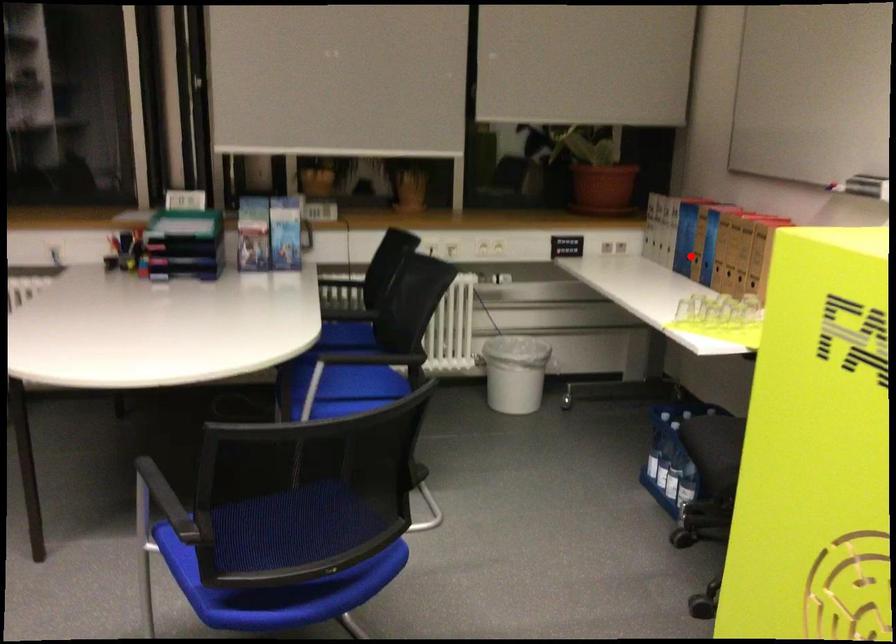
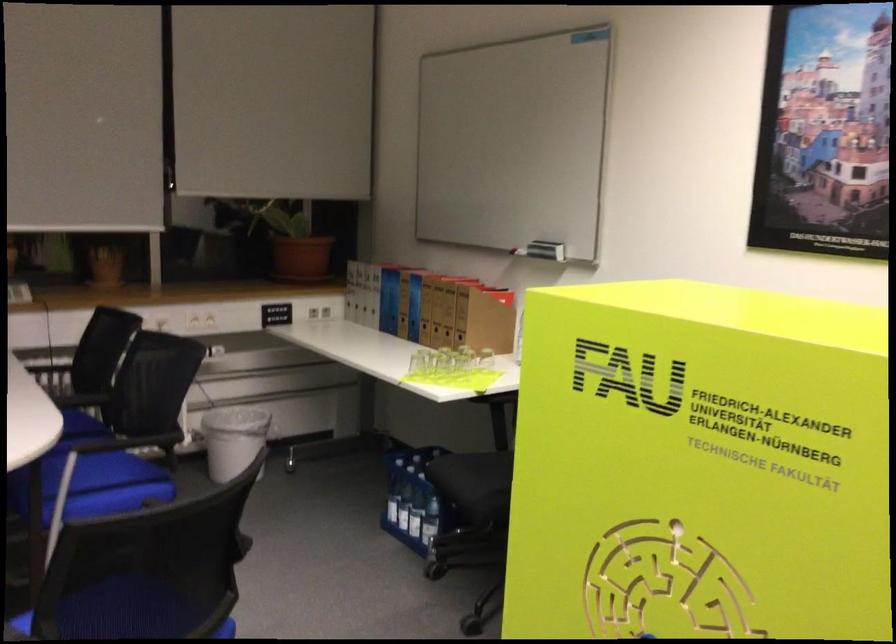
Locate, in the second image, the point that corresponds to the highlighted location in the first image.

(398, 317)